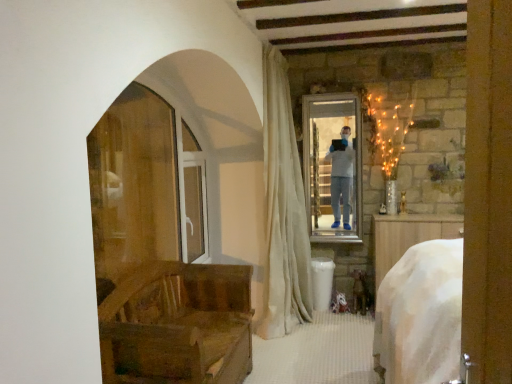
Based on the photo, measure the distance between point (269,298) and camera.

They are 3.28 meters apart.

Describe the element at coordinates (178, 325) in the screenshot. I see `wooden chair at left` at that location.

Find the location of a particular element. clear glass screen door at center is located at coordinates (193, 195).

From a real-world perspective, which object stands above the other?

In real-world perspective, white velvet curtain at center is above.

Which is in front, point (174, 318) or point (274, 287)?

Point (174, 318)

Based on their sizes in the image, would you say wooden chair at left is bigger or smaller than white velvet curtain at center?

wooden chair at left is smaller than white velvet curtain at center.

Considering the points (188, 262) and (200, 326), which point is behind, point (188, 262) or point (200, 326)?

The point (188, 262) is farther from the camera.

Considering the sizes of objects clear glass screen door at center and wooden chair at left in the image provided, who is taller, clear glass screen door at center or wooden chair at left?

clear glass screen door at center is taller.

From a real-world perspective, who is located lower, clear glass screen door at center or wooden chair at left?

wooden chair at left, from a real-world perspective.

Considering the relative positions of white velvet curtain at center and wooden chair at left in the image provided, is white velvet curtain at center to the left of wooden chair at left from the viewer's perspective?

No, white velvet curtain at center is not to the left of wooden chair at left.

Is white velvet curtain at center not close to wooden chair at left?

No, white velvet curtain at center is in close proximity to wooden chair at left.

Does white velvet curtain at center turn towards wooden chair at left?

No, white velvet curtain at center is not aimed at wooden chair at left.

You are a GUI agent. You are given a task and a screenshot of the screen. Output one action in this format:
    pyautogui.click(x=<x>, y=<y>)
    Task: Click on the furniture below the white velvet curtain at center (from the image's perspective)
    
    Given the screenshot: What is the action you would take?
    pyautogui.click(x=178, y=325)

From a real-world perspective, is white velvet curtain at center positioned above or below clear glass screen door at center?

In terms of real-world spatial position, white velvet curtain at center is above clear glass screen door at center.

Considering the relative sizes of white velvet curtain at center and clear glass screen door at center in the image provided, is white velvet curtain at center bigger than clear glass screen door at center?

Correct, white velvet curtain at center is larger in size than clear glass screen door at center.

Is point (276, 158) less distant than point (189, 212)?

Yes, it is in front of point (189, 212).

Is white velvet curtain at center next to clear glass screen door at center and touching it?

There is a gap between white velvet curtain at center and clear glass screen door at center.

Can you tell me how much clear glass screen door at center and white velvet curtain at center differ in facing direction?

0.693 degrees.

Where is `curtain in front of the clear glass screen door at center`? Image resolution: width=512 pixels, height=384 pixels. curtain in front of the clear glass screen door at center is located at coordinates (283, 208).

Is clear glass screen door at center facing towards white velvet curtain at center?

Yes, clear glass screen door at center is aimed at white velvet curtain at center.

Which is less distant, (201,218) or (276,320)?

Point (201,218) is positioned farther from the camera compared to point (276,320).

How many degrees apart are the facing directions of wooden chair at left and clear glass screen door at center?

1.57 degrees separate the facing orientations of wooden chair at left and clear glass screen door at center.

From the image's perspective, which is below, wooden chair at left or clear glass screen door at center?

wooden chair at left appears lower in the image.

From a real-world perspective, between wooden chair at left and clear glass screen door at center, who is vertically lower?

wooden chair at left, from a real-world perspective.

Is point (154, 275) in front of point (192, 246)?

That is True.

Image resolution: width=512 pixels, height=384 pixels. I want to click on curtain that is behind the wooden chair at left, so click(283, 208).

The height and width of the screenshot is (384, 512). Find the location of `furniture below the clear glass screen door at center (from a real-world perspective)`. furniture below the clear glass screen door at center (from a real-world perspective) is located at coordinates (178, 325).

Which object lies further to the anchor point clear glass screen door at center, white velvet curtain at center or wooden chair at left?

Based on the image, wooden chair at left appears to be further to clear glass screen door at center.

Based on their spatial positions, is white velvet curtain at center or clear glass screen door at center further from wooden chair at left?

clear glass screen door at center is further to wooden chair at left.

From the picture: When comparing their distances from white velvet curtain at center, does clear glass screen door at center or wooden chair at left seem further?

Based on the image, wooden chair at left appears to be further to white velvet curtain at center.

Looking at the image, which one is located closer to white velvet curtain at center, wooden chair at left or clear glass screen door at center?

Based on the image, clear glass screen door at center appears to be nearer to white velvet curtain at center.

Considering their positions, is wooden chair at left positioned closer to clear glass screen door at center than white velvet curtain at center?

white velvet curtain at center lies closer to clear glass screen door at center than the other object.

When comparing their distances from wooden chair at left, does clear glass screen door at center or white velvet curtain at center seem closer?

Among the two, white velvet curtain at center is located nearer to wooden chair at left.

You are a GUI agent. You are given a task and a screenshot of the screen. Output one action in this format:
    pyautogui.click(x=<x>, y=<y>)
    Task: Click on the curtain between wooden chair at left and clear glass screen door at center in the front-back direction
    The image size is (512, 384).
    Given the screenshot: What is the action you would take?
    pyautogui.click(x=283, y=208)